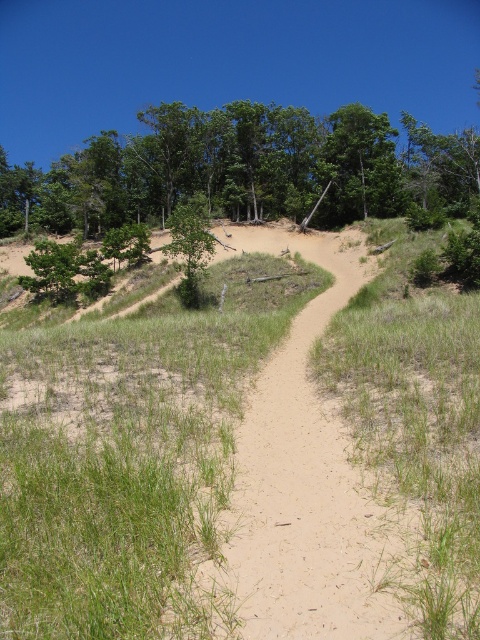
Question: Estimate the real-world distances between objects in this image. Which object is farther from the green leafy tree at upper center?

Choices:
 (A) green grass at center
 (B) green matte tree at center

Answer: (A)

Question: Among these points, which one is farthest from the camera?

Choices:
 (A) (85, 218)
 (B) (202, 225)
 (C) (336, 488)

Answer: (A)

Question: Is green grass at center thinner than green leafy tree at upper center?

Choices:
 (A) yes
 (B) no

Answer: (A)

Question: Considering the relative positions of green grass at center and green matte tree at center in the image provided, where is green grass at center located with respect to green matte tree at center?

Choices:
 (A) below
 (B) above

Answer: (A)

Question: Which object is closer to the camera taking this photo?

Choices:
 (A) green leafy tree at upper center
 (B) green grass at center
 (C) green matte tree at center

Answer: (B)

Question: Is green grass at center to the left of green leafy tree at upper center from the viewer's perspective?

Choices:
 (A) no
 (B) yes

Answer: (B)